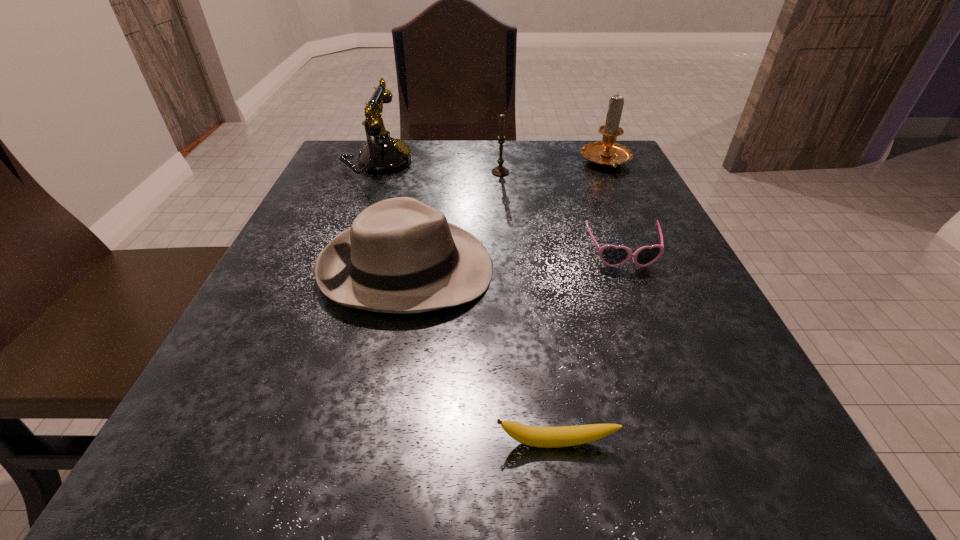
At what (x,y) coordinates should I click in order to perform the action: click on free area in between the sunglasses and the telephone. Please return your answer as a coordinate pair (x, y). The width and height of the screenshot is (960, 540). Looking at the image, I should click on (500, 209).

This screenshot has width=960, height=540. In order to click on free area in between the nearest object and the fourth tallest object in this screenshot , I will do `click(482, 356)`.

Identify the location of vacant point located between the telephone and the nearest object. (467, 303).

The height and width of the screenshot is (540, 960). What are the coordinates of `vacant space that's between the telephone and the sunglasses` in the screenshot? It's located at (500, 209).

Locate an element on the screen. This screenshot has width=960, height=540. object that is the third closest to the nearest object is located at coordinates (383, 154).

The height and width of the screenshot is (540, 960). In order to click on the fifth closest object to the sunglasses in this screenshot , I will do `click(383, 154)`.

This screenshot has width=960, height=540. Identify the location of free spot that satisfies the following two spatial constraints: 1. on the front side of the taller candle; 2. on the front-facing side of the fourth tallest object. (656, 269).

Image resolution: width=960 pixels, height=540 pixels. I want to click on vacant space that satisfies the following two spatial constraints: 1. on the front-facing side of the sunglasses; 2. on the front-facing side of the third shortest object, so click(x=629, y=269).

This screenshot has height=540, width=960. Find the location of `vacant space that satisfies the following two spatial constraints: 1. on the dial of the telephone; 2. on the right side of the right candle`. vacant space that satisfies the following two spatial constraints: 1. on the dial of the telephone; 2. on the right side of the right candle is located at coordinates (377, 163).

Locate an element on the screen. free location that satisfies the following two spatial constraints: 1. on the dial of the telephone; 2. on the right side of the taller candle is located at coordinates (377, 163).